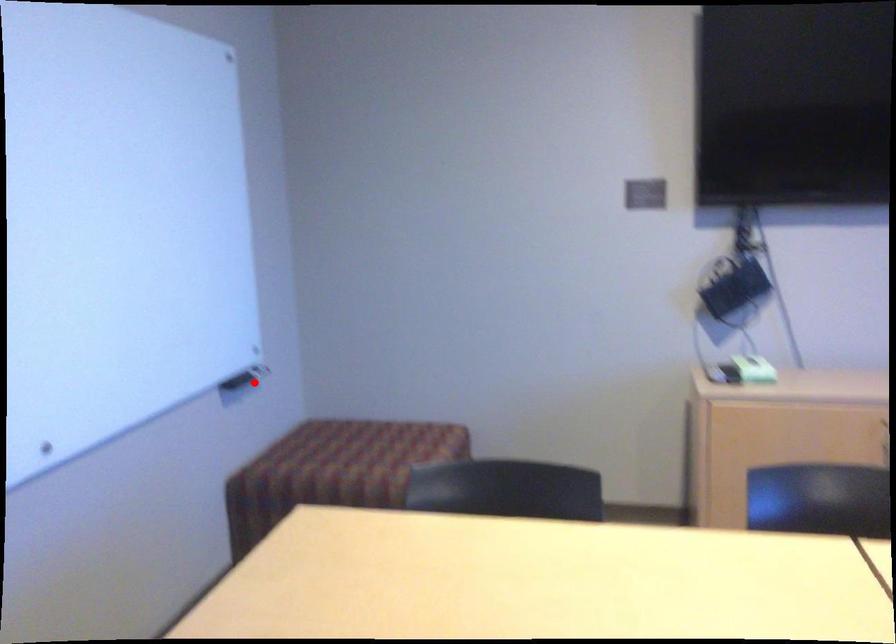
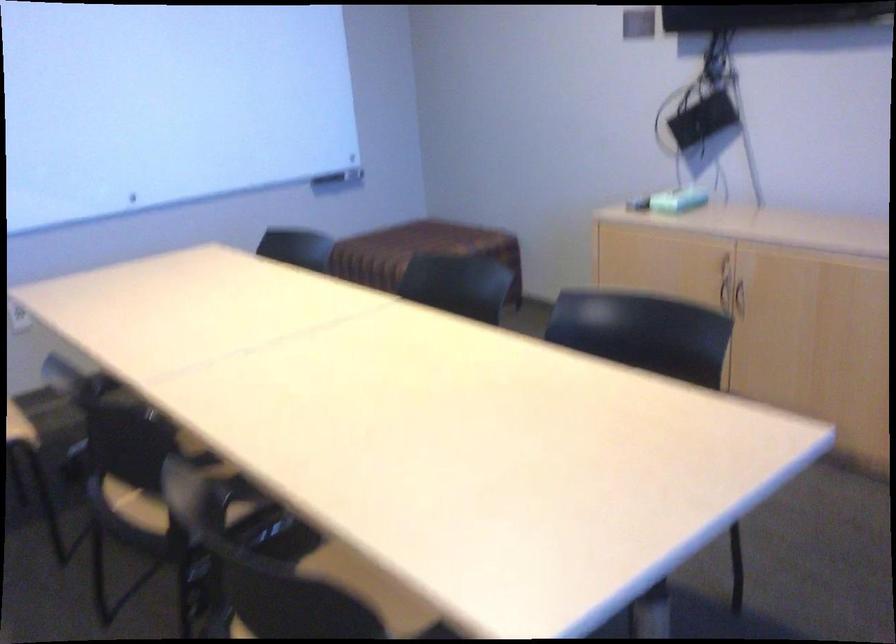
Question: I am providing you with two images of the same scene from different viewpoints. Given a red point in image1, look at the same physical point in image2. Is it:

Choices:
 (A) Closer to the viewpoint
 (B) Farther from the viewpoint

Answer: (B)